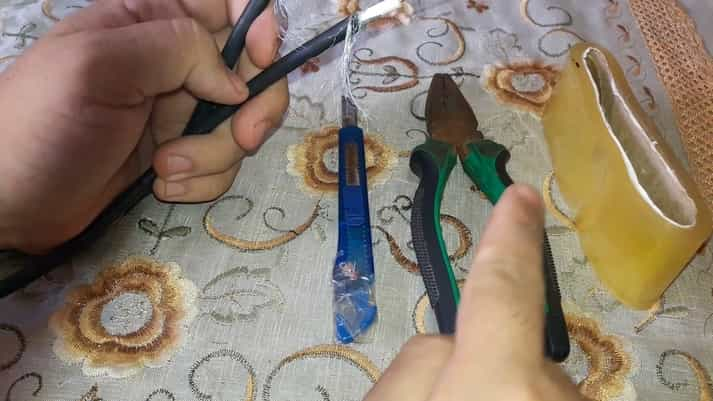
Locate an element on the screen. tape roll is located at coordinates (615, 159).